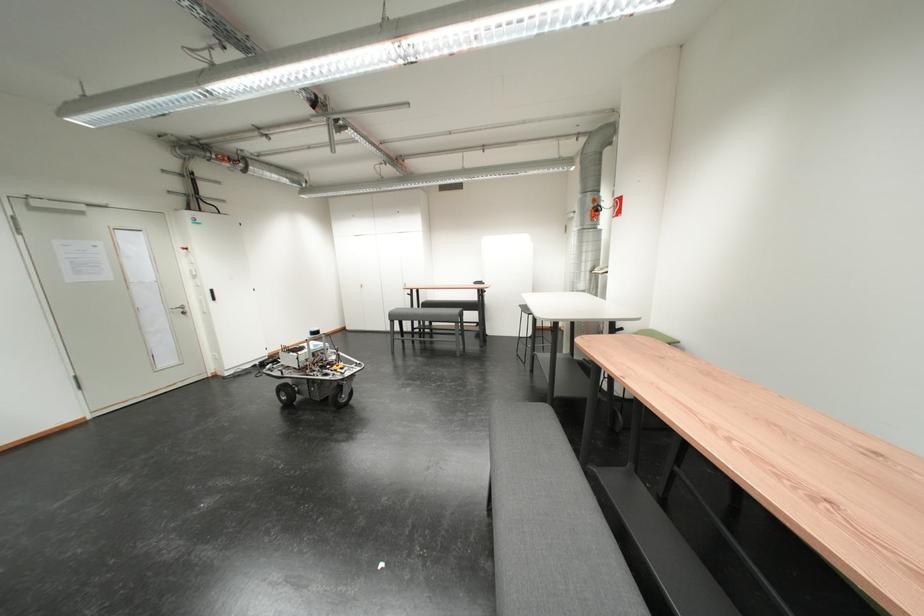
Where would you sit the chair sitting surface? Please return your answer as a coordinate pair (x, y).

(427, 315)